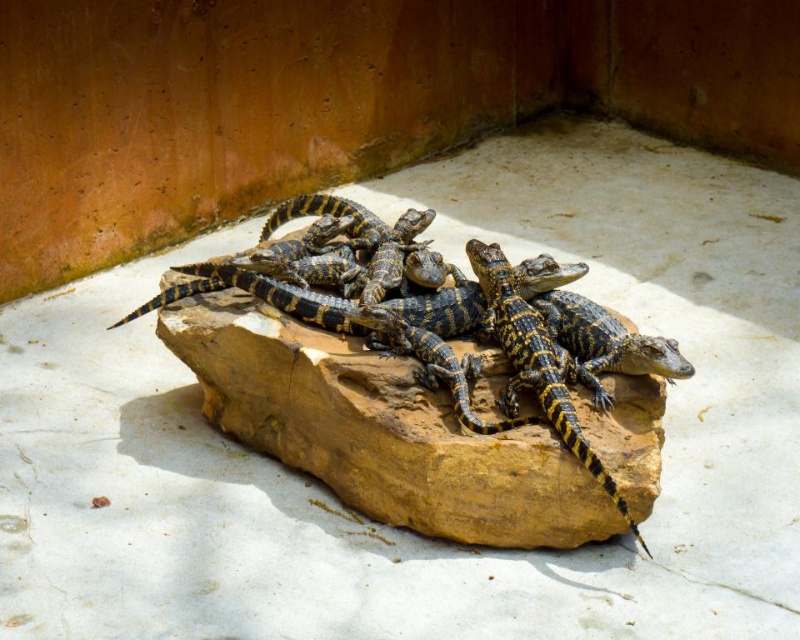
Can you confirm if yellow-black textured crocodile at center is thinner than yellow-black scaly crocodile at center?

No.

Can you confirm if yellow-black textured crocodile at center is positioned to the left of yellow-black scaly crocodile at center?

Correct, you'll find yellow-black textured crocodile at center to the left of yellow-black scaly crocodile at center.

What are the coordinates of `yellow-black textured crocodile at center` in the screenshot? It's located at tap(409, 417).